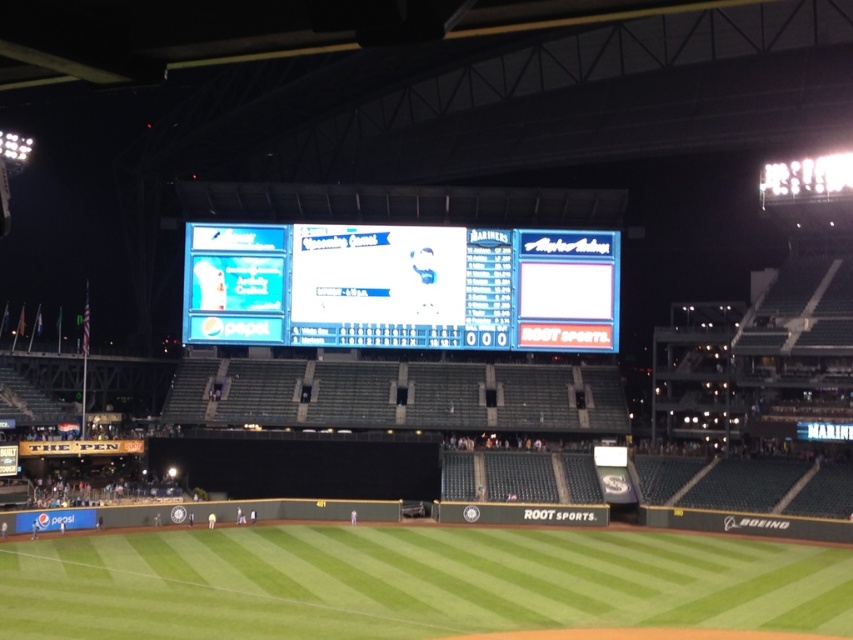
Question: Can you confirm if green grass at center is thinner than blue glossy scoreboard at center?

Choices:
 (A) no
 (B) yes

Answer: (A)

Question: Can you confirm if green grass at center is wider than blue glossy scoreboard at center?

Choices:
 (A) no
 (B) yes

Answer: (B)

Question: Does green grass at center appear on the right side of blue glossy scoreboard at center?

Choices:
 (A) no
 (B) yes

Answer: (B)

Question: Which point is farther to the camera?

Choices:
 (A) green grass at center
 (B) blue glossy scoreboard at center

Answer: (B)